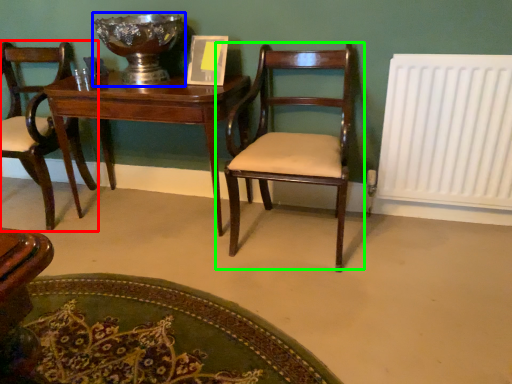
Question: Based on their relative distances, which object is nearer to chair (highlighted by a red box)? Choose from glass bowl (highlighted by a blue box) and chair (highlighted by a green box).

Choices:
 (A) glass bowl
 (B) chair

Answer: (A)